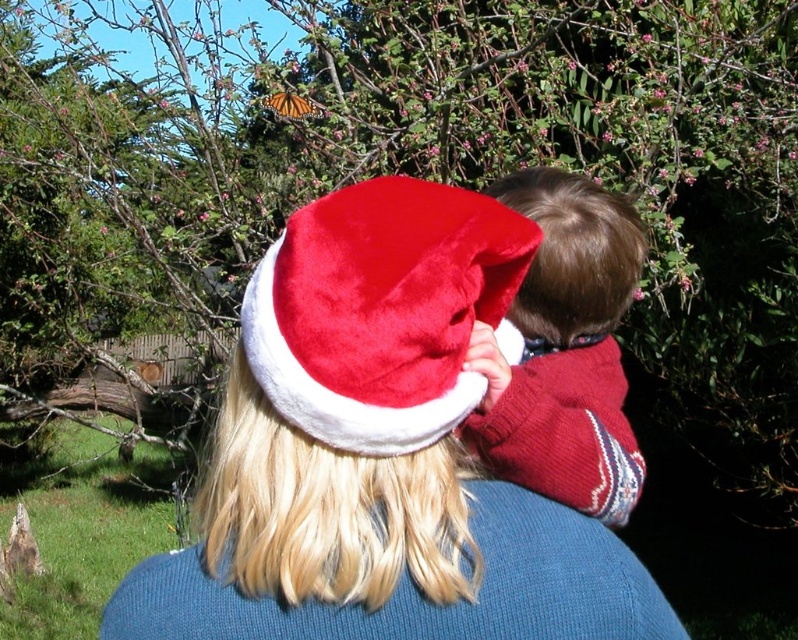
Question: Which point appears closest to the camera in this image?

Choices:
 (A) 279,99
 (B) 318,291

Answer: (B)

Question: Is velvet santa hat at center below velvety red sweater at upper right?

Choices:
 (A) no
 (B) yes

Answer: (B)

Question: Can you confirm if velvet red santa hat at center is positioned to the right of orange translucent butterfly at upper center?

Choices:
 (A) no
 (B) yes

Answer: (B)

Question: Which point is farther to the camera?

Choices:
 (A) velvet red santa hat at center
 (B) orange translucent butterfly at upper center

Answer: (B)

Question: Which object appears closest to the camera in this image?

Choices:
 (A) velvety red sweater at upper right
 (B) orange translucent butterfly at upper center
 (C) velvet red santa hat at center

Answer: (C)

Question: Is the position of velvety red sweater at upper right less distant than that of orange translucent butterfly at upper center?

Choices:
 (A) no
 (B) yes

Answer: (B)